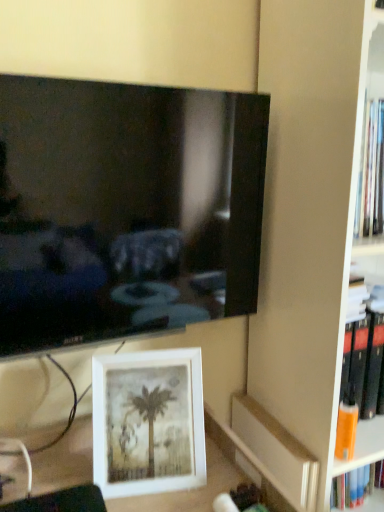
Question: Does matte black bookshelf at right have a lesser height compared to orange matte paperback book at lower right?

Choices:
 (A) no
 (B) yes

Answer: (A)

Question: Is the depth of matte black bookshelf at right greater than that of orange matte paperback book at lower right?

Choices:
 (A) no
 (B) yes

Answer: (A)

Question: Is orange matte paperback book at lower right surrounded by matte black bookshelf at right?

Choices:
 (A) yes
 (B) no

Answer: (A)

Question: From a real-world perspective, is matte black bookshelf at right on top of orange matte paperback book at lower right?

Choices:
 (A) yes
 (B) no

Answer: (A)

Question: Considering the relative sizes of matte black bookshelf at right and orange matte paperback book at lower right in the image provided, is matte black bookshelf at right taller than orange matte paperback book at lower right?

Choices:
 (A) no
 (B) yes

Answer: (B)

Question: Is matte black bookshelf at right facing towards orange matte paperback book at lower right?

Choices:
 (A) no
 (B) yes

Answer: (A)

Question: Does white matte picture frame at lower center have a greater width compared to orange matte paperback book at lower right?

Choices:
 (A) yes
 (B) no

Answer: (B)

Question: Can you confirm if white matte picture frame at lower center is smaller than orange matte paperback book at lower right?

Choices:
 (A) no
 (B) yes

Answer: (A)

Question: Considering the relative sizes of white matte picture frame at lower center and orange matte paperback book at lower right in the image provided, is white matte picture frame at lower center taller than orange matte paperback book at lower right?

Choices:
 (A) no
 (B) yes

Answer: (B)

Question: Can we say white matte picture frame at lower center lies outside orange matte paperback book at lower right?

Choices:
 (A) no
 (B) yes

Answer: (B)

Question: From a real-world perspective, is white matte picture frame at lower center beneath orange matte paperback book at lower right?

Choices:
 (A) no
 (B) yes

Answer: (A)

Question: Does white matte picture frame at lower center come behind orange matte paperback book at lower right?

Choices:
 (A) no
 (B) yes

Answer: (A)

Question: Can you confirm if white matte picture frame at lower center is positioned to the left of matte black bookshelf at right?

Choices:
 (A) no
 (B) yes

Answer: (B)